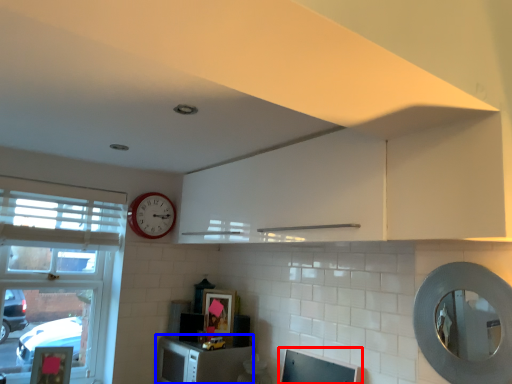
Question: Among these objects, which one is farthest to the camera, computer monitor (highlighted by a red box) or cabinetry (highlighted by a blue box)?

Choices:
 (A) computer monitor
 (B) cabinetry

Answer: (B)